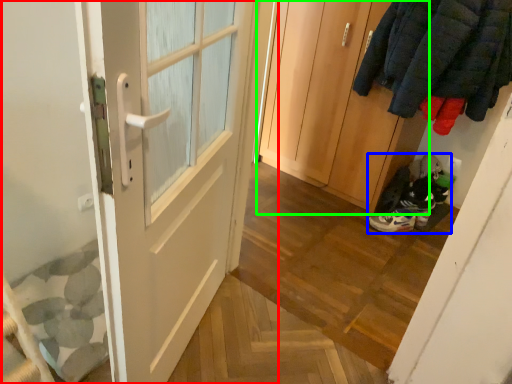
Question: Which object is positioned farthest from door (highlighted by a red box)? Select from footwear (highlighted by a blue box) and door (highlighted by a green box).

Choices:
 (A) footwear
 (B) door

Answer: (A)